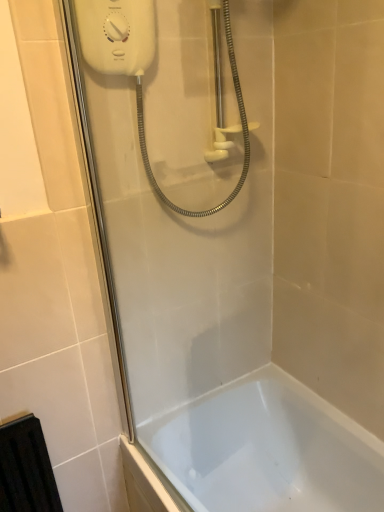
Question: Is white plastic shower at upper center next to white glossy bathtub at lower center?

Choices:
 (A) no
 (B) yes

Answer: (A)

Question: From a real-world perspective, is white plastic shower at upper center located beneath white glossy bathtub at lower center?

Choices:
 (A) no
 (B) yes

Answer: (A)

Question: Is white plastic shower at upper center positioned behind white glossy bathtub at lower center?

Choices:
 (A) yes
 (B) no

Answer: (B)

Question: Considering the relative sizes of white plastic shower at upper center and white glossy bathtub at lower center in the image provided, is white plastic shower at upper center shorter than white glossy bathtub at lower center?

Choices:
 (A) yes
 (B) no

Answer: (B)

Question: Is white plastic shower at upper center taller than white glossy bathtub at lower center?

Choices:
 (A) yes
 (B) no

Answer: (A)

Question: Considering their positions, is white glossy bathtub at lower center located in front of or behind white plastic shower at upper center?

Choices:
 (A) front
 (B) behind

Answer: (B)

Question: In terms of width, does white glossy bathtub at lower center look wider or thinner when compared to white plastic shower at upper center?

Choices:
 (A) wide
 (B) thin

Answer: (A)

Question: Do you think white glossy bathtub at lower center is within white plastic shower at upper center, or outside of it?

Choices:
 (A) inside
 (B) outside

Answer: (B)

Question: Considering the positions of white glossy bathtub at lower center and white plastic shower at upper center in the image, is white glossy bathtub at lower center taller or shorter than white plastic shower at upper center?

Choices:
 (A) tall
 (B) short

Answer: (B)

Question: Visually, is white glossy shower door at upper left positioned to the left or to the right of white plastic shower at upper center?

Choices:
 (A) left
 (B) right

Answer: (A)

Question: From the image's perspective, is white glossy shower door at upper left located above or below white plastic shower at upper center?

Choices:
 (A) below
 (B) above

Answer: (A)

Question: In terms of width, does white glossy shower door at upper left look wider or thinner when compared to white plastic shower at upper center?

Choices:
 (A) thin
 (B) wide

Answer: (A)

Question: In terms of height, does white glossy shower door at upper left look taller or shorter compared to white plastic shower at upper center?

Choices:
 (A) short
 (B) tall

Answer: (B)

Question: Considering their positions, is white glossy bathtub at lower center located in front of or behind white glossy shower door at upper left?

Choices:
 (A) behind
 (B) front

Answer: (A)

Question: Is white glossy bathtub at lower center taller or shorter than white glossy shower door at upper left?

Choices:
 (A) short
 (B) tall

Answer: (A)